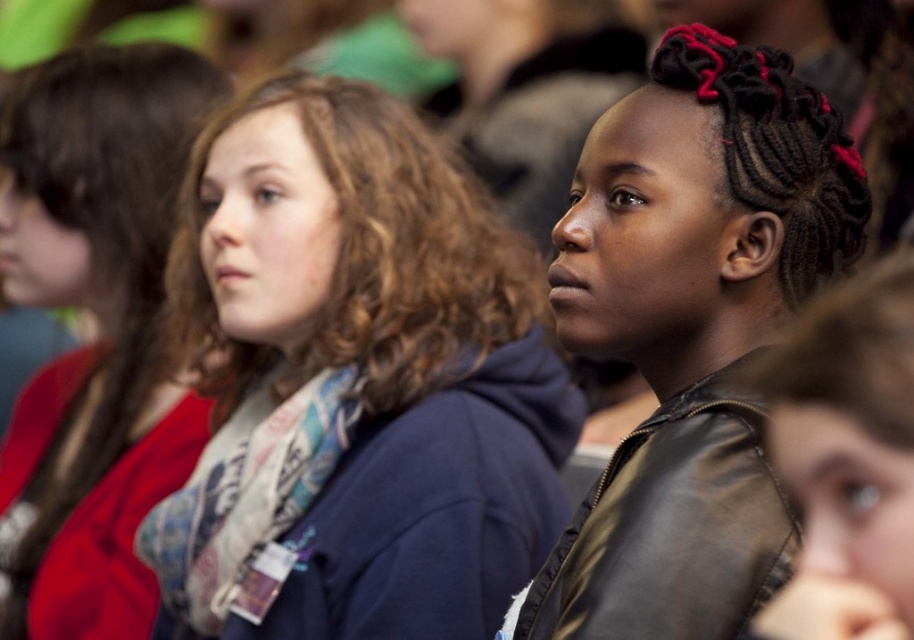
You are an event organizer arranging a photo shoot for the attendees. You need to place a name tag on the leftmost object between the matte blue hoodie at center and the leather jacket at center. Which object should you place the name tag on?

The matte blue hoodie at center is to the left of the leather jacket at center, so you should place the name tag on the matte blue hoodie at center.

You are a photographer trying to capture a clear shot of both the matte blue hoodie at center and the red scarf at left. Since you can only focus on one object at a time, which one should you choose to ensure the other remains in the background?

The matte blue hoodie at center is closer to the viewer than the red scarf at left. To have the other object in the background, focus on the matte blue hoodie at center so the red scarf at left will be behind it.

You are organizing a photo shoot and need to place a large poster between the black leather jacket at center and the red scarf at left. Considering their sizes, which object should the poster be placed closer to to ensure it fits better?

The poster should be placed closer to the red scarf at left because the black leather jacket at center is narrower than the red scarf at left, so the poster will fit better near the wider object.